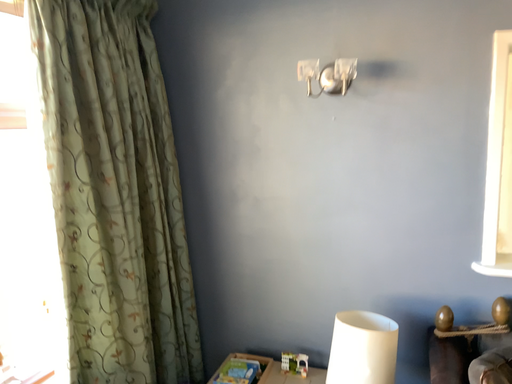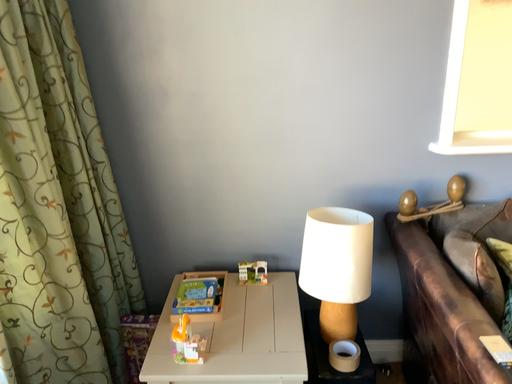
Question: How did the camera likely rotate when shooting the video?

Choices:
 (A) rotated left
 (B) rotated right

Answer: (B)